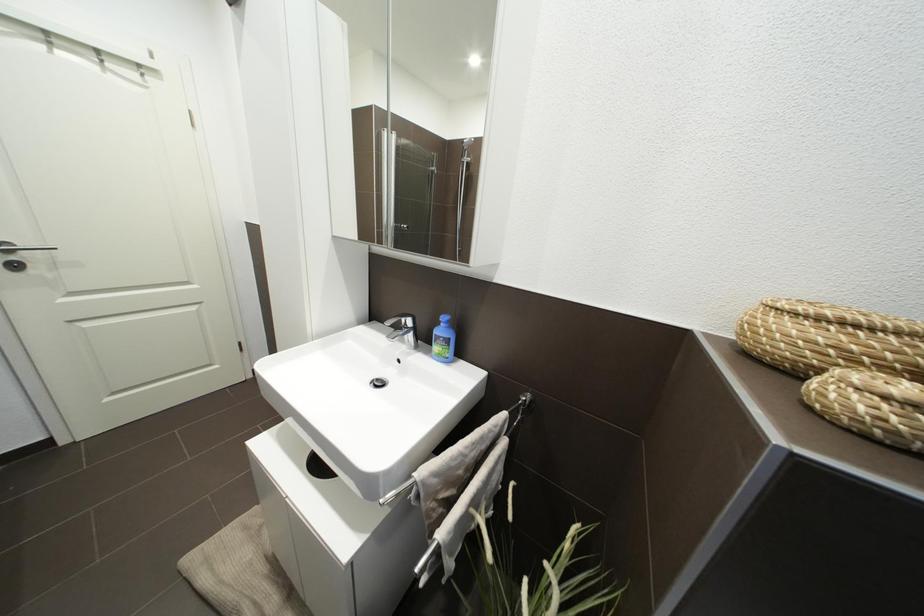
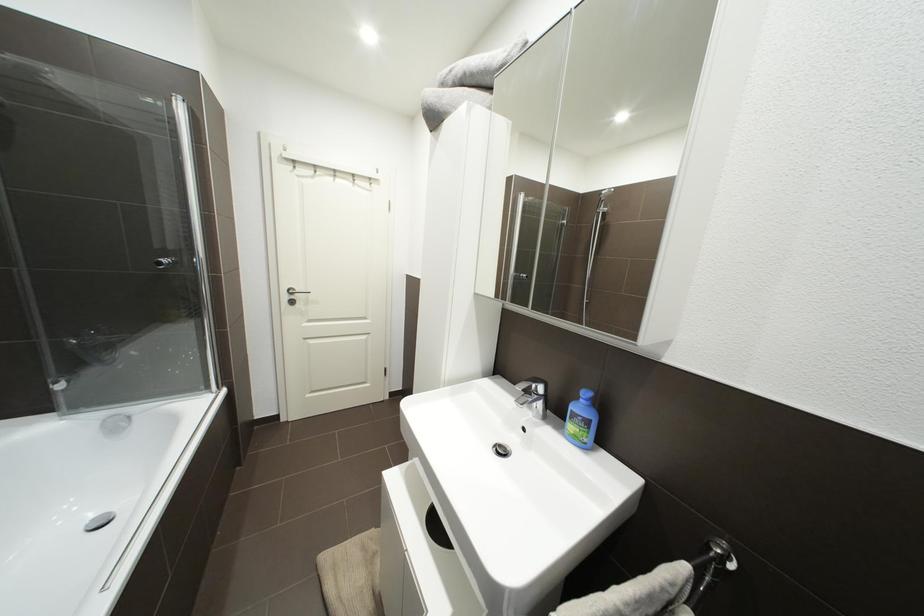
Question: Which direction would the cameraman need to move to produce the second image? Reply with the corresponding letter.

Choices:
 (A) Left
 (B) Right
 (C) Forward
 (D) Backward

Answer: (A)